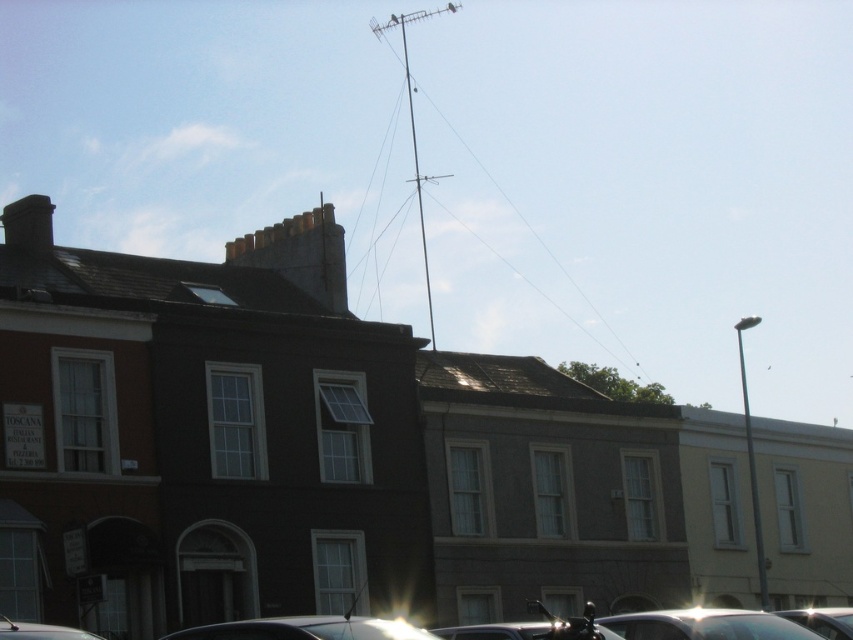
You are a delivery person trying to park your shiny silver car at lower center in this residential area. The parking spot you want is located at coordinates point 0.9, 0.8. Can your car fit into that spot?

The shiny silver car at lower center is positioned at point (705, 625), which is very close to the desired parking spot at (682, 576). Since the coordinates are nearly aligned, the car should fit into the spot.

You are a delivery drone that needs to land between the metallic antenna at upper center and the metallic silver car at lower right. Since you must avoid obstacles, can you safely land there if your landing area requires 2 meters of clear space?

The metallic antenna at upper center is larger in size than the metallic silver car at lower right, but the description does not provide specific measurements of the distance between them. Without knowing the actual distance, it is impossible to determine if there is enough clear space for the drone to land safely.

You are standing at the point closest to the bottom of the image and looking towards the top. There are two points marked in the scene, one at point (380, 36) and another at point (828, 634). Which point is closer to your current position?

Point (380, 36) is behind point (828, 634), so the point closer to your current position at the bottom is point (828, 634).